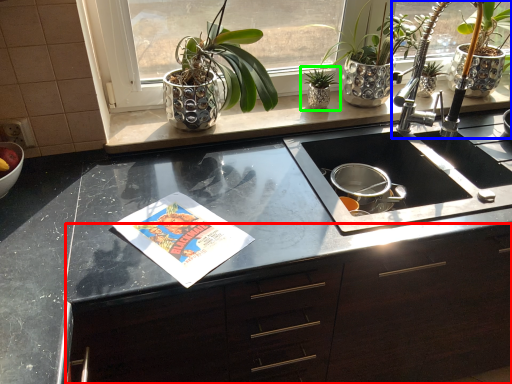
Question: Considering the real-world distances, which object is closest to cabinetry (highlighted by a red box)? tap (highlighted by a blue box) or houseplant (highlighted by a green box).

Choices:
 (A) tap
 (B) houseplant

Answer: (A)